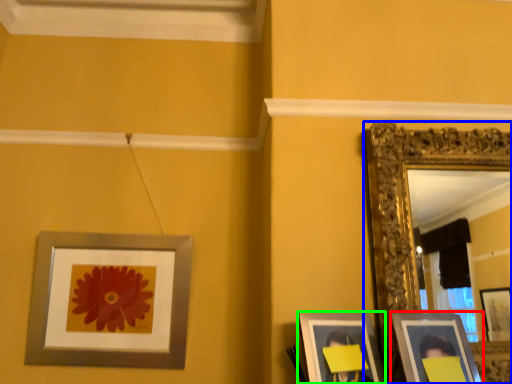
Question: Which object is the farthest from picture frame (highlighted by a red box)? Choose among these: picture frame (highlighted by a blue box) or picture frame (highlighted by a green box).

Choices:
 (A) picture frame
 (B) picture frame

Answer: (A)